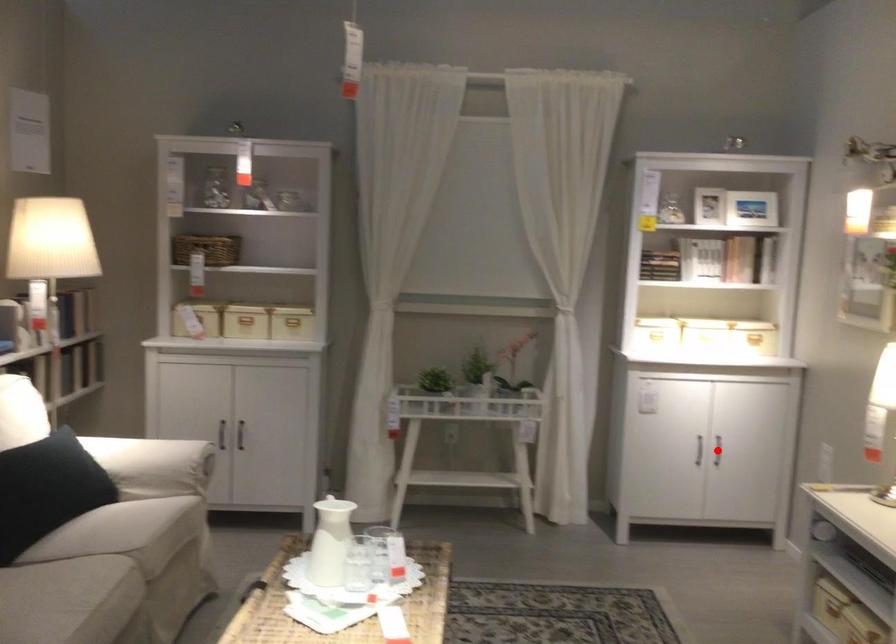
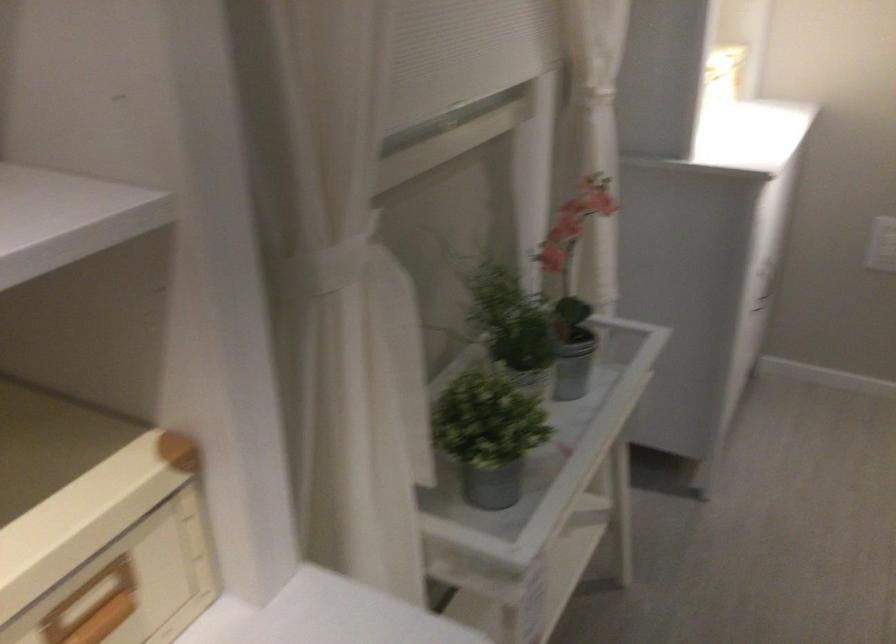
Question: I am providing you with two images of the same scene from different viewpoints. A red point is marked on the first image. At the location where the point appears in image 1, is it still visible in image 2?

Choices:
 (A) Yes
 (B) No

Answer: (B)